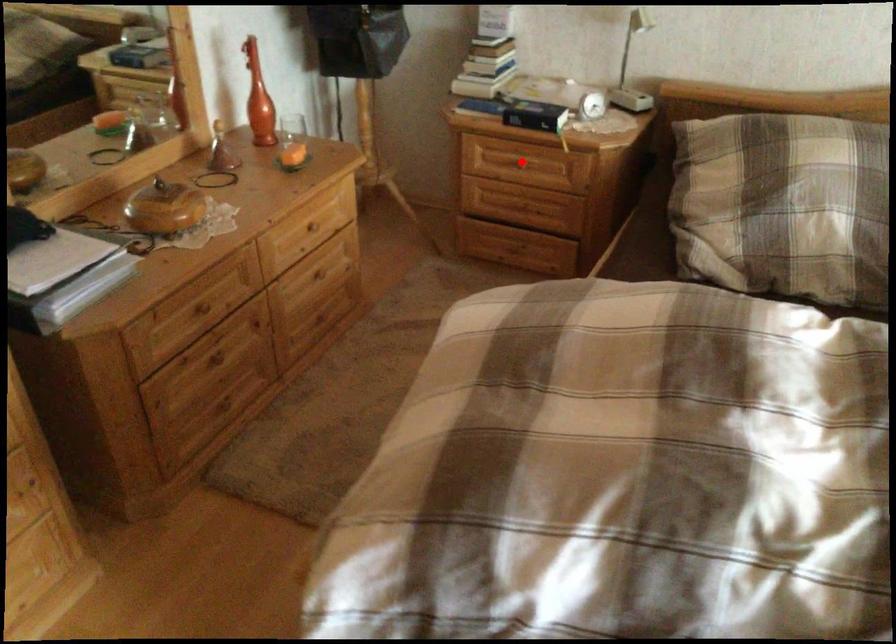
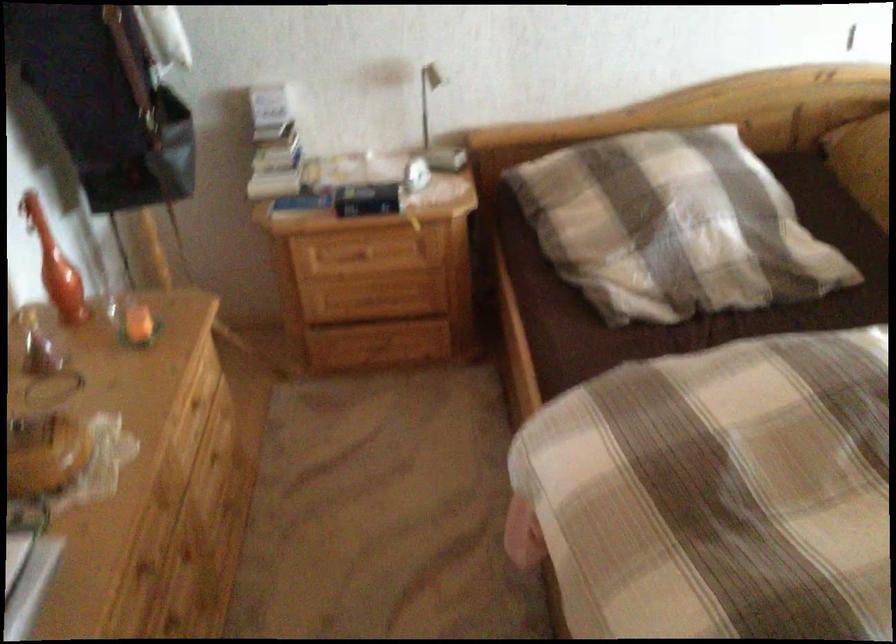
In the second image, find the point that corresponds to the highlighted location in the first image.

(366, 252)